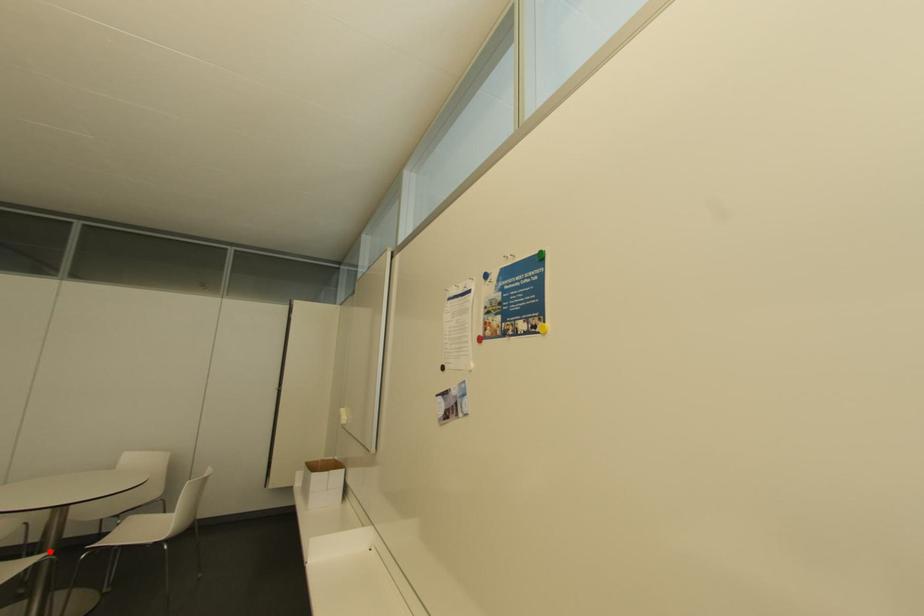
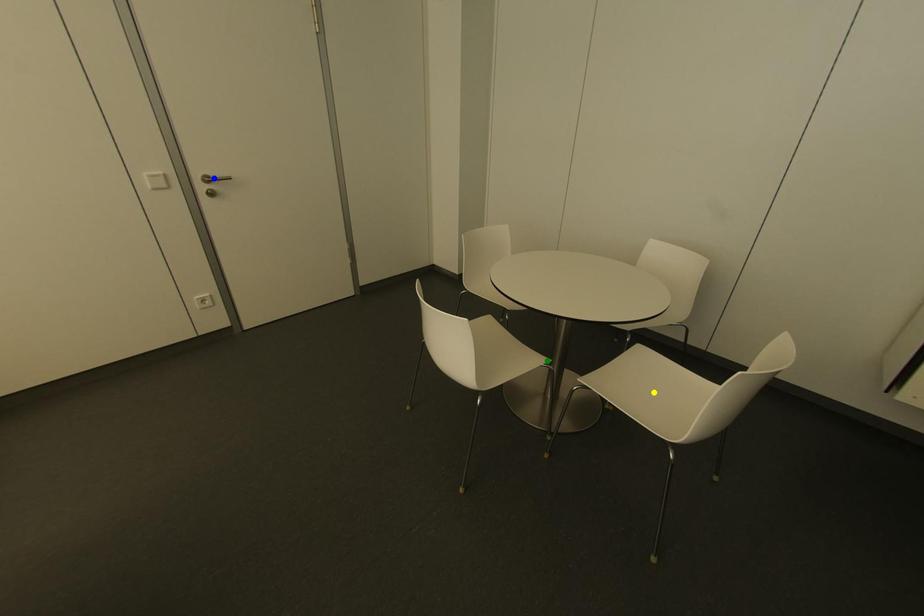
Question: I am providing you with two images of the same scene from different viewpoints. A red point is marked on the first image. You are given multiple points on the second image. In image 2, which mark is for the same physical point as the one in image 1?

Choices:
 (A) blue point
 (B) yellow point
 (C) green point

Answer: (C)